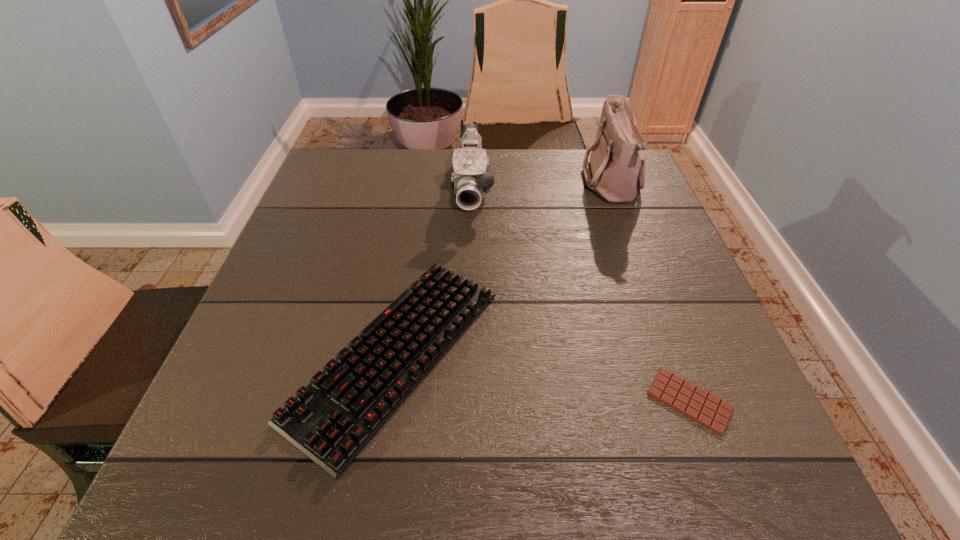
This screenshot has width=960, height=540. In order to click on free space at the far edge in this screenshot , I will do `click(404, 190)`.

This screenshot has height=540, width=960. Find the location of `free space at the left edge of the desktop`. free space at the left edge of the desktop is located at coordinates (282, 338).

In the image, there is a desktop. Where is `blank space at the right edge`? This screenshot has width=960, height=540. blank space at the right edge is located at coordinates (597, 199).

Locate an element on the screen. vacant region at the far left corner of the desktop is located at coordinates pyautogui.click(x=348, y=175).

You are a GUI agent. You are given a task and a screenshot of the screen. Output one action in this format:
    pyautogui.click(x=<x>, y=<y>)
    Task: Click on the vacant space at the near right corner
    
    Given the screenshot: What is the action you would take?
    pyautogui.click(x=719, y=464)

Where is `free space between the shoulder bag and the shortest object`? The width and height of the screenshot is (960, 540). free space between the shoulder bag and the shortest object is located at coordinates (650, 293).

At what (x,y) coordinates should I click in order to perform the action: click on vacant area that lies between the shoulder bag and the computer keyboard. Please return your answer as a coordinate pair (x, y). Looking at the image, I should click on (504, 269).

The image size is (960, 540). I want to click on vacant region between the shoulder bag and the computer keyboard, so click(x=504, y=269).

Where is `free area in between the shortest object and the shoulder bag`? The image size is (960, 540). free area in between the shortest object and the shoulder bag is located at coordinates (650, 293).

I want to click on free spot between the candy bar and the camcorder, so click(x=581, y=294).